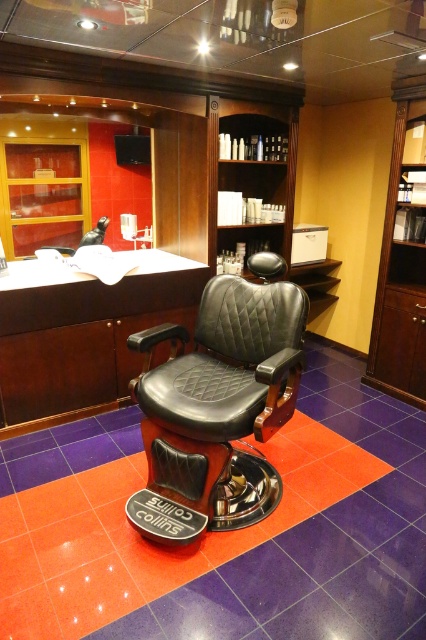
Can you confirm if wooden bookshelf at right is positioned below woodenmaterial/texturebookshelf at upper center?

Yes, wooden bookshelf at right is below woodenmaterial/texturebookshelf at upper center.

Is wooden bookshelf at right to the right of woodenmaterial/texturebookshelf at upper center from the viewer's perspective?

Correct, you'll find wooden bookshelf at right to the right of woodenmaterial/texturebookshelf at upper center.

In order to click on wooden bookshelf at right in this screenshot , I will do `click(400, 269)`.

Does black leather swivel chair at center appear over woodenmaterial/texturebookshelf at upper center?

Actually, black leather swivel chair at center is below woodenmaterial/texturebookshelf at upper center.

Between black leather swivel chair at center and woodenmaterial/texturebookshelf at upper center, which one appears on the left side from the viewer's perspective?

From the viewer's perspective, black leather swivel chair at center appears more on the left side.

Between point (278, 324) and point (290, 150), which one is positioned behind?

The point (290, 150) is more distant.

The width and height of the screenshot is (426, 640). I want to click on black leather swivel chair at center, so click(224, 394).

Is black leather swivel chair at center taller than wooden bookshelf at right?

In fact, black leather swivel chair at center may be shorter than wooden bookshelf at right.

What do you see at coordinates (224, 394) in the screenshot? This screenshot has height=640, width=426. I see `black leather swivel chair at center` at bounding box center [224, 394].

Where is `black leather swivel chair at center`? black leather swivel chair at center is located at coordinates (224, 394).